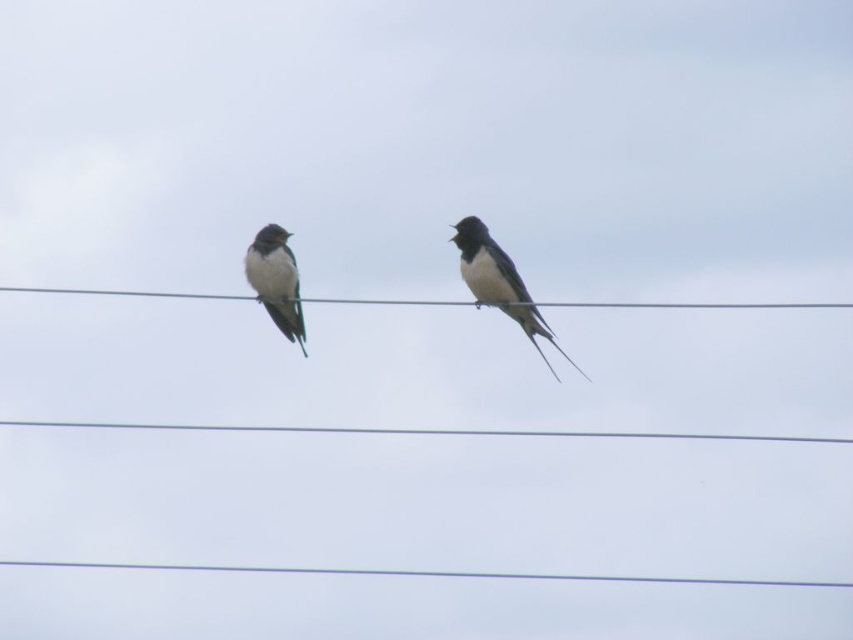
Question: Which object is the farthest from the metallic wire at center?

Choices:
 (A) white matte bird at left
 (B) black glossy swallow at center

Answer: (B)

Question: Which object is the closest to the metallic wire at center?

Choices:
 (A) black glossy swallow at center
 (B) white matte bird at left

Answer: (B)

Question: Does black glossy swallow at center lie behind metallic wire at center?

Choices:
 (A) yes
 (B) no

Answer: (B)

Question: Does metallic wire at center have a greater width compared to white matte bird at left?

Choices:
 (A) no
 (B) yes

Answer: (B)

Question: Is metallic wire at center thinner than white matte bird at left?

Choices:
 (A) no
 (B) yes

Answer: (A)

Question: Which point is closer to the camera?

Choices:
 (A) (299, 339)
 (B) (465, 252)
 (C) (833, 305)

Answer: (B)